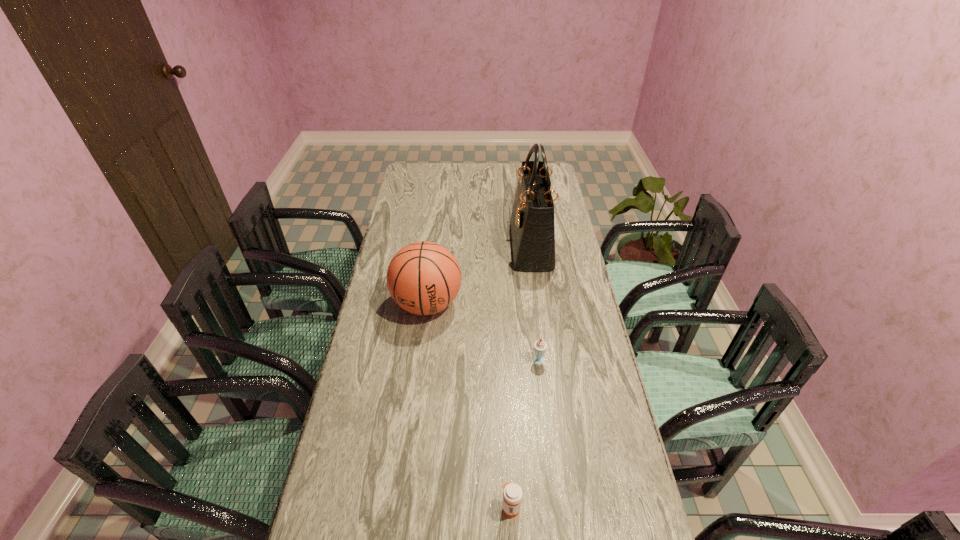
This screenshot has width=960, height=540. I want to click on the tallest object, so click(532, 220).

Identify the location of handbag. (532, 220).

At what (x,y) coordinates should I click in order to perform the action: click on the leftmost object. Please return your answer as a coordinate pair (x, y). Looking at the image, I should click on (423, 278).

Where is `the second farthest object`? The width and height of the screenshot is (960, 540). the second farthest object is located at coordinates (423, 278).

Locate an element on the screen. the third farthest object is located at coordinates (540, 346).

This screenshot has width=960, height=540. I want to click on the nearest object, so click(512, 494).

What are the coordinates of `medicine` in the screenshot? It's located at (512, 494).

The width and height of the screenshot is (960, 540). Find the location of `vacant point located 0.380m at the front of the tallest object with visible charms`. vacant point located 0.380m at the front of the tallest object with visible charms is located at coordinates (420, 246).

Find the location of a particular element. free space located 0.190m at the front of the tallest object with visible charms is located at coordinates (467, 246).

What are the coordinates of `free spot located at the front of the tallest object with visible charms` in the screenshot? It's located at (447, 246).